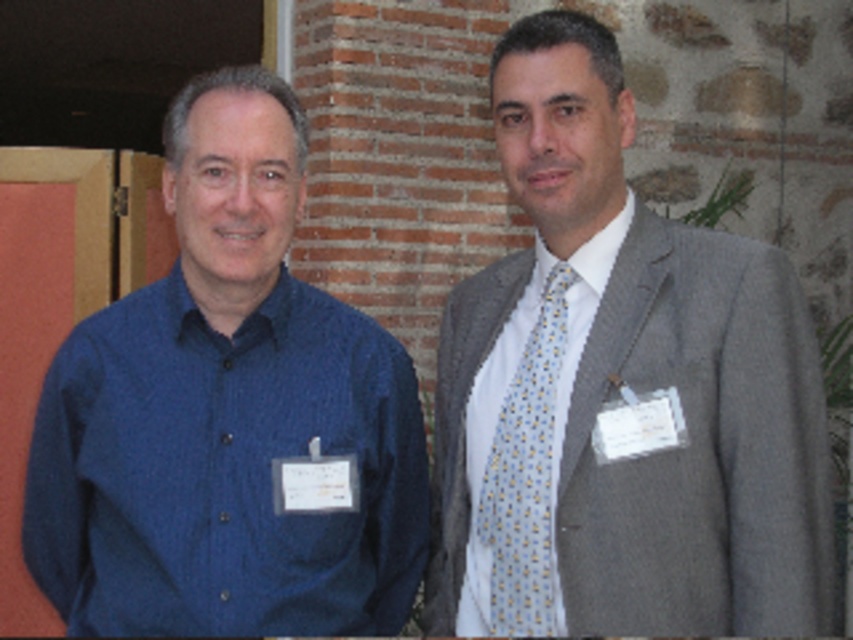
Question: Estimate the real-world distances between objects in this image. Which object is farther from the white textured shirt at center?

Choices:
 (A) blue textured shirt at left
 (B) gray textured suit at right
 (C) light blue silk tie at right

Answer: (A)

Question: Considering the real-world distances, which object is farthest from the gray textured suit at right?

Choices:
 (A) blue textured shirt at left
 (B) light blue silk tie at right
 (C) white textured shirt at center

Answer: (A)

Question: Is gray textured suit at right below white textured shirt at center?

Choices:
 (A) yes
 (B) no

Answer: (B)

Question: Can you confirm if gray textured suit at right is positioned to the right of blue textured shirt at left?

Choices:
 (A) no
 (B) yes

Answer: (B)

Question: Can you confirm if gray textured suit at right is positioned below white textured shirt at center?

Choices:
 (A) yes
 (B) no

Answer: (B)

Question: Which point is farther from the camera taking this photo?

Choices:
 (A) (271, 202)
 (B) (543, 369)

Answer: (B)